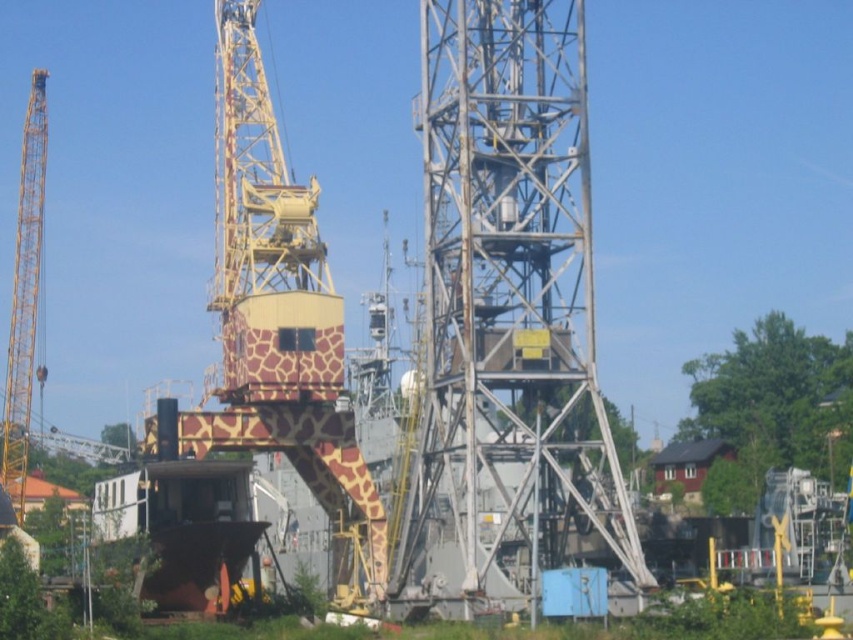
Between metallic gray tower at center and blue painted metal lift at center, which one is positioned lower?

blue painted metal lift at center

Measure the distance between point (450, 116) and camera.

They are 112.80 meters apart.

Locate an element on the screen. This screenshot has width=853, height=640. metallic gray tower at center is located at coordinates (506, 323).

Between yellow metallic crane at left and blue painted metal lift at center, which one is positioned higher?

yellow metallic crane at left is above.

Find the location of `yellow metallic crane at left`. yellow metallic crane at left is located at coordinates (24, 296).

Does metallic gray tower at center have a greater width compared to giraffe-patterned wood at center?

No.

Is point (518, 189) behind point (337, 547)?

That is False.

Where is `metallic gray tower at center`? The width and height of the screenshot is (853, 640). metallic gray tower at center is located at coordinates (506, 323).